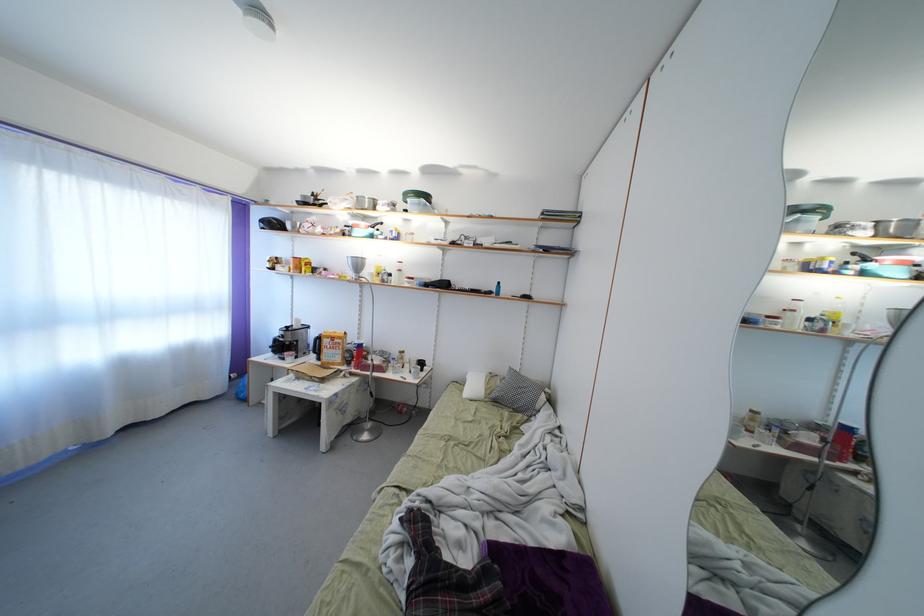
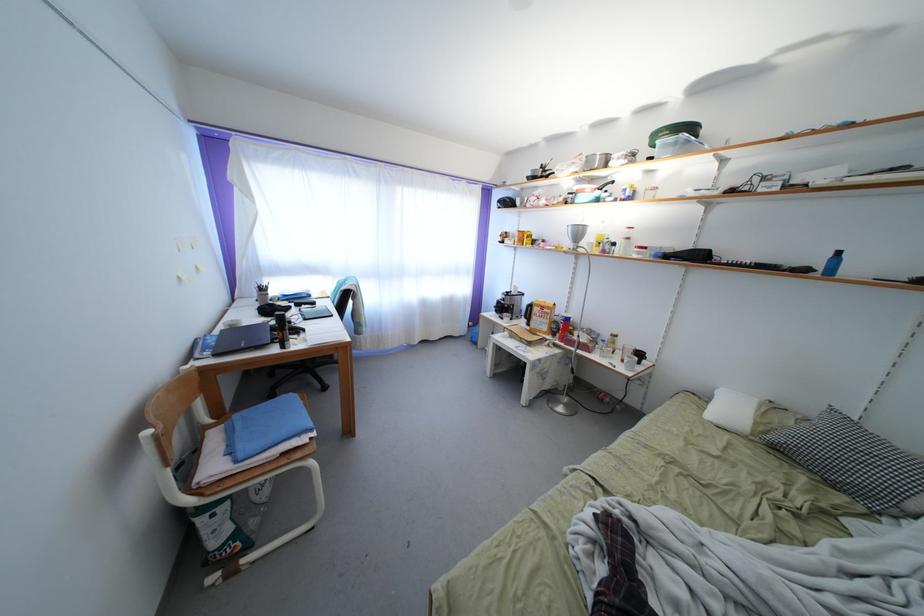
Locate, in the second image, the point that corresponds to pixel 411 371 in the first image.

(624, 359)